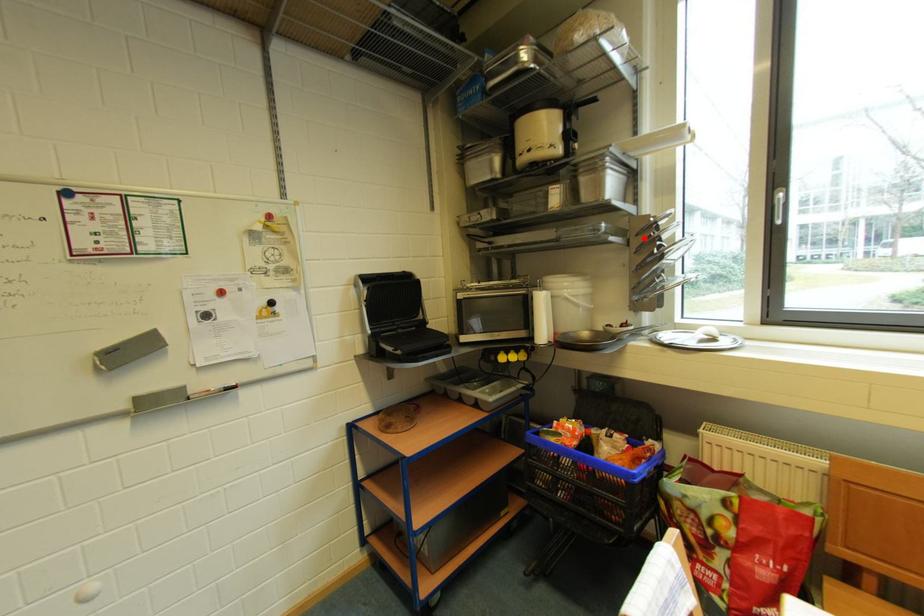
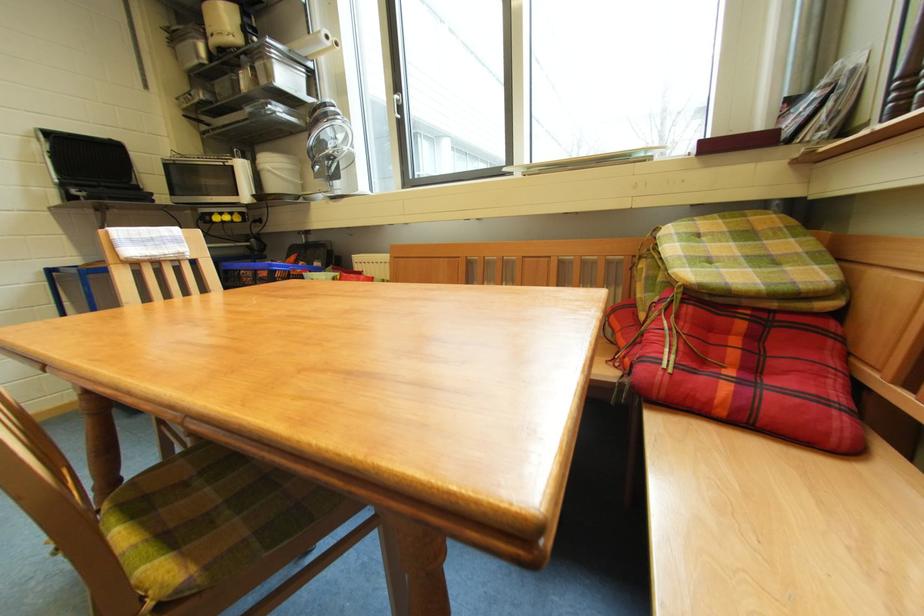
Locate, in the second image, the point that corresponds to the highlighted location in the first image.

(319, 121)